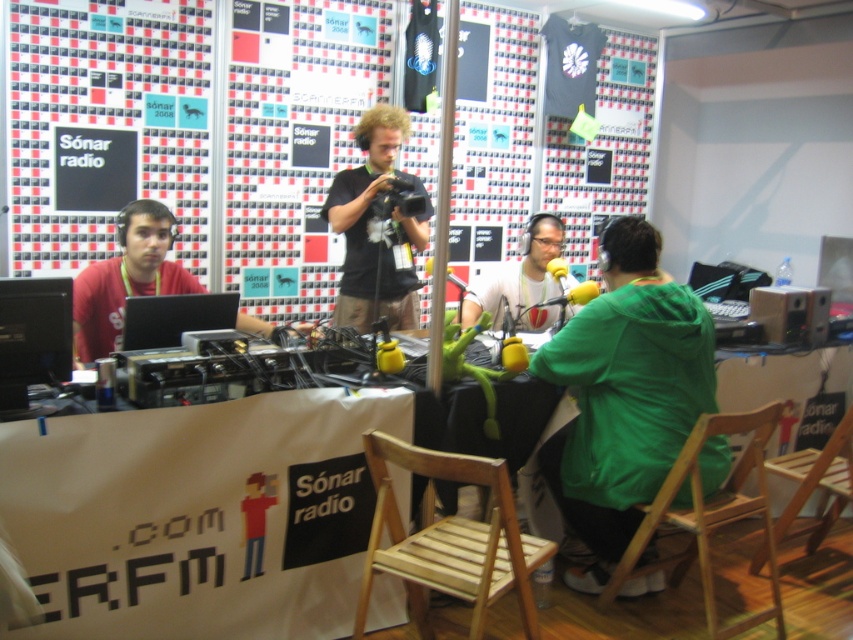
Does green matte jacket at lower right appear over wooden chair at center?

Correct, green matte jacket at lower right is located above wooden chair at center.

Does green matte jacket at lower right have a smaller size compared to wooden chair at center?

No, green matte jacket at lower right is not smaller than wooden chair at center.

Is point (555, 499) closer to viewer compared to point (374, 568)?

That is False.

Image resolution: width=853 pixels, height=640 pixels. Find the location of `green matte jacket at lower right`. green matte jacket at lower right is located at coordinates (624, 394).

Does green matte jacket at lower right appear over green matte jacket at center?

No.

Consider the image. Who is shorter, green matte jacket at lower right or green matte jacket at center?

Standing shorter between the two is green matte jacket at center.

Is point (590, 417) closer to viewer compared to point (505, 284)?

That is True.

Where is `green matte jacket at lower right`? green matte jacket at lower right is located at coordinates (624, 394).

Is wooden chair at center shorter than matte black camera at center?

Yes, wooden chair at center is shorter than matte black camera at center.

Is point (430, 477) closer to viewer compared to point (379, 132)?

Yes, it is in front of point (379, 132).

Describe the element at coordinates (448, 538) in the screenshot. I see `wooden chair at center` at that location.

Locate an element on the screen. The height and width of the screenshot is (640, 853). wooden chair at center is located at coordinates (448, 538).